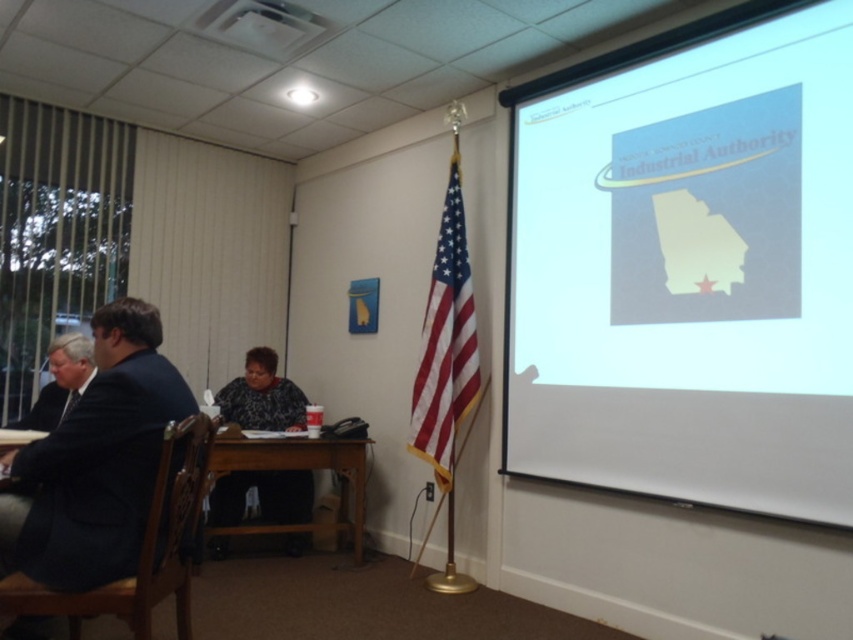
Who is more forward, (x=207, y=486) or (x=229, y=19)?

Point (x=229, y=19) is more forward.

Where is `brown wooden table at center`? The image size is (853, 640). brown wooden table at center is located at coordinates (291, 468).

Can you confirm if american flag at center is wider than brown wooden table at center?

No, american flag at center is not wider than brown wooden table at center.

Can you confirm if american flag at center is positioned above brown wooden table at center?

Yes.

Is point (416, 403) farther from camera compared to point (283, 438)?

No, it is in front of (283, 438).

Identify the location of american flag at center. The width and height of the screenshot is (853, 640). (445, 342).

Who is positioned more to the right, american flag at center or patterned fabric shirt at center?

american flag at center is more to the right.

Who is lower down, american flag at center or patterned fabric shirt at center?

patterned fabric shirt at center is lower down.

Is point (438, 268) closer to viewer compared to point (223, 552)?

Yes, it is.

This screenshot has width=853, height=640. Find the location of `american flag at center`. american flag at center is located at coordinates (445, 342).